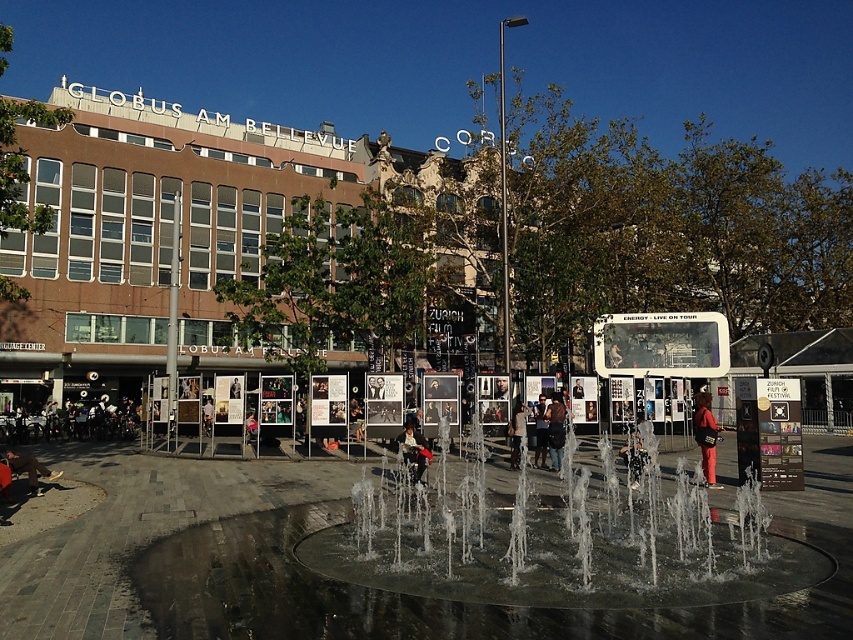
Question: Is dark blue jeans at center wider than brown leather jacket at lower left?

Choices:
 (A) no
 (B) yes

Answer: (B)

Question: Estimate the real-world distances between objects in this image. Which object is closer to the matte red pants at center?

Choices:
 (A) clear glass water at center
 (B) denim jacket at center
 (C) metallic silver helmet at center

Answer: (C)

Question: Which of the following is the closest to the observer?

Choices:
 (A) (695, 403)
 (B) (637, 461)
 (C) (560, 420)
 (D) (535, 458)

Answer: (B)

Question: Is matte red pants at center behind brown leather jacket at lower left?

Choices:
 (A) no
 (B) yes

Answer: (B)

Question: Which object is closer to the camera taking this photo?

Choices:
 (A) dark brown leather jacket at center
 (B) denim jacket at center
 (C) matte black jacket at center

Answer: (B)

Question: Does matte red pants at center have a greater width compared to brown leather jacket at lower left?

Choices:
 (A) yes
 (B) no

Answer: (B)